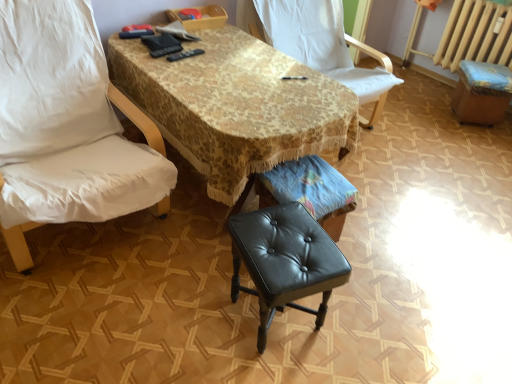
What is the approximate height of white fabric chair at center, the first chair positioned from the right?

36.21 inches.

What do you see at coordinates (482, 92) in the screenshot? The width and height of the screenshot is (512, 384). I see `black leather bar stool at lower right` at bounding box center [482, 92].

Identify the location of black leather stool at center. The height and width of the screenshot is (384, 512). (285, 261).

This screenshot has width=512, height=384. Describe the element at coordinates (67, 128) in the screenshot. I see `white fabric chair at left, which is the second chair in right-to-left order` at that location.

Find the location of `gold lace tablecloth at center`. gold lace tablecloth at center is located at coordinates (236, 106).

Consider the image. Can you confirm if gold lace tablecloth at center is bigger than black leather bar stool at lower right?

Yes.

From a real-world perspective, is gold lace tablecloth at center over black leather bar stool at lower right?

Indeed, from a real-world perspective, gold lace tablecloth at center stands above black leather bar stool at lower right.

Can you confirm if gold lace tablecloth at center is positioned to the right of black leather bar stool at lower right?

Incorrect, gold lace tablecloth at center is not on the right side of black leather bar stool at lower right.

Is black leather stool at center facing towards white fabric chair at center, the first chair positioned from the right?

No.

Would you consider black leather stool at center to be distant from white fabric chair at center, the first chair positioned from the right?

Yes, black leather stool at center and white fabric chair at center, the first chair positioned from the right, are quite far apart.

Does black leather stool at center have a lesser width compared to white fabric chair at center, the first chair positioned from the right?

Indeed, black leather stool at center has a lesser width compared to white fabric chair at center, the first chair positioned from the right.

Is gold lace tablecloth at center facing towards black leather music stool at center?

Yes, gold lace tablecloth at center is oriented towards black leather music stool at center.

Is point (215, 182) in front of point (323, 176)?

Yes, it is in front of point (323, 176).

Is gold lace tablecloth at center next to black leather music stool at center?

No, gold lace tablecloth at center is not beside black leather music stool at center.

Does gold lace tablecloth at center contain black leather music stool at center?

Yes, black leather music stool at center is inside gold lace tablecloth at center.

Considering the sizes of objects black leather bar stool at lower right and gold lace tablecloth at center in the image provided, who is smaller, black leather bar stool at lower right or gold lace tablecloth at center?

Smaller between the two is black leather bar stool at lower right.

From the image's perspective, is black leather bar stool at lower right on top of gold lace tablecloth at center?

Yes, from the image's perspective, black leather bar stool at lower right is over gold lace tablecloth at center.

The image size is (512, 384). What are the coordinates of `bar stool that appears behind the gold lace tablecloth at center` in the screenshot? It's located at (482, 92).

From a real-world perspective, is black leather bar stool at lower right on gold lace tablecloth at center?

No, from a real-world perspective, black leather bar stool at lower right is not above gold lace tablecloth at center.

Is white fabric chair at center, the second chair viewed from the left, placed right next to gold lace tablecloth at center?

No, white fabric chair at center, the second chair viewed from the left, is not in contact with gold lace tablecloth at center.

Is gold lace tablecloth at center at the back of white fabric chair at center, the second chair viewed from the left?

No, white fabric chair at center, the second chair viewed from the left, is not facing the opposite direction of gold lace tablecloth at center.

The width and height of the screenshot is (512, 384). I want to click on table directly beneath the white fabric chair at center, the second chair viewed from the left (from a real-world perspective), so click(x=236, y=106).

Which is in front, point (342, 44) or point (176, 87)?

Positioned in front is point (176, 87).

How many degrees apart are the facing directions of white fabric chair at left, which is the second chair in right-to-left order, and gold lace tablecloth at center?

2.37 degrees separate the facing orientations of white fabric chair at left, which is the second chair in right-to-left order, and gold lace tablecloth at center.

Does white fabric chair at left, which appears as the first chair when viewed from the left, have a lesser height compared to gold lace tablecloth at center?

No, white fabric chair at left, which appears as the first chair when viewed from the left, is not shorter than gold lace tablecloth at center.

From a real-world perspective, who is located lower, white fabric chair at left, which appears as the first chair when viewed from the left, or gold lace tablecloth at center?

gold lace tablecloth at center.

Would you say white fabric chair at left, which appears as the first chair when viewed from the left, is inside or outside gold lace tablecloth at center?

The correct answer is: outside.

Which object is closer to the camera taking this photo, black leather bar stool at lower right or white fabric chair at left, which appears as the first chair when viewed from the left?

Positioned in front is white fabric chair at left, which appears as the first chair when viewed from the left.

This screenshot has width=512, height=384. In order to click on bar stool behind the white fabric chair at left, which is the second chair in right-to-left order in this screenshot , I will do `click(482, 92)`.

Is black leather bar stool at lower right to the left of white fabric chair at left, which is the second chair in right-to-left order, from the viewer's perspective?

Answer: No.

From the image's perspective, is black leather bar stool at lower right above white fabric chair at left, which is the second chair in right-to-left order?

Yes.

Find the location of a particular element. This screenshot has height=384, width=512. bar stool behind the gold lace tablecloth at center is located at coordinates (482, 92).

From a real-world perspective, count 1st chairs upward from the black leather stool at center and point to it. Please provide its 2D coordinates.

[(326, 46)]

Estimate the real-world distances between objects in this image. Which object is further from gold lace tablecloth at center, black leather bar stool at lower right or white fabric chair at center, the second chair viewed from the left?

The object further to gold lace tablecloth at center is black leather bar stool at lower right.

Which object lies further to the anchor point white fabric chair at center, the first chair positioned from the right, black leather bar stool at lower right or white fabric chair at left, which appears as the first chair when viewed from the left?

white fabric chair at left, which appears as the first chair when viewed from the left.

Which object lies nearer to the anchor point black leather bar stool at lower right, white fabric chair at left, which appears as the first chair when viewed from the left, or white fabric chair at center, the first chair positioned from the right?

The object closer to black leather bar stool at lower right is white fabric chair at center, the first chair positioned from the right.

Estimate the real-world distances between objects in this image. Which object is closer to white fabric chair at left, which is the second chair in right-to-left order, black leather bar stool at lower right or black leather stool at center?

black leather stool at center lies closer to white fabric chair at left, which is the second chair in right-to-left order, than the other object.

Based on their spatial positions, is black leather stool at center or white fabric chair at left, which appears as the first chair when viewed from the left, closer to gold lace tablecloth at center?

The object closer to gold lace tablecloth at center is white fabric chair at left, which appears as the first chair when viewed from the left.

Based on their spatial positions, is white fabric chair at left, which is the second chair in right-to-left order, or black leather stool at center further from black leather bar stool at lower right?

white fabric chair at left, which is the second chair in right-to-left order, lies further to black leather bar stool at lower right than the other object.

When comparing their distances from white fabric chair at left, which appears as the first chair when viewed from the left, does black leather bar stool at lower right or gold lace tablecloth at center seem closer?

gold lace tablecloth at center is closer to white fabric chair at left, which appears as the first chair when viewed from the left.

Estimate the real-world distances between objects in this image. Which object is closer to white fabric chair at center, the first chair positioned from the right, black leather bar stool at lower right or gold lace tablecloth at center?

gold lace tablecloth at center is positioned closer to the anchor white fabric chair at center, the first chair positioned from the right.

I want to click on table between white fabric chair at left, which appears as the first chair when viewed from the left, and white fabric chair at center, the second chair viewed from the left, in the horizontal direction, so click(x=236, y=106).

At what (x,y) coordinates should I click in order to perform the action: click on chair between black leather music stool at center and black leather bar stool at lower right from left to right. Please return your answer as a coordinate pair (x, y). This screenshot has width=512, height=384. Looking at the image, I should click on [x=326, y=46].

Where is `chair between black leather stool at center and black leather bar stool at lower right in the horizontal direction`? The height and width of the screenshot is (384, 512). chair between black leather stool at center and black leather bar stool at lower right in the horizontal direction is located at coordinates (326, 46).

Find the location of a particular element. table between white fabric chair at left, which is the second chair in right-to-left order, and black leather stool at center, in the horizontal direction is located at coordinates (236, 106).